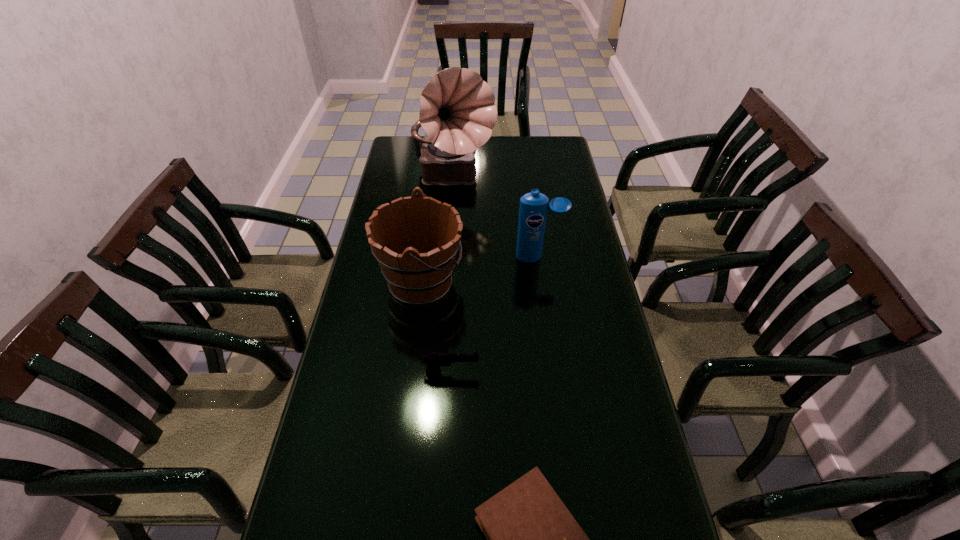
Locate an element on the screen. vacant space in between the second shortest object and the shampoo is located at coordinates (494, 314).

Select which object appears as the closest to the record player. Please provide its 2D coordinates. Your answer should be formatted as a tuple, i.e. [(x, y)], where the tuple contains the x and y coordinates of a point satisfying the conditions above.

[(421, 274)]

Find the location of a particular element. This screenshot has height=540, width=960. object that is the fourth closest one to the wine bucket is located at coordinates (532, 539).

Find the location of a particular element. vacant space that satisfies the following two spatial constraints: 1. from the horn of the farthest object; 2. with the handle on the wine bucket is located at coordinates point(446,283).

Find the location of a particular element. The width and height of the screenshot is (960, 540). vacant space that satisfies the following two spatial constraints: 1. from the horn of the farthest object; 2. with the handle on the wine bucket is located at coordinates (446, 283).

Locate an element on the screen. The width and height of the screenshot is (960, 540). vacant space that satisfies the following two spatial constraints: 1. on the front side of the shampoo; 2. with the handle on the wine bucket is located at coordinates (542, 283).

Locate an element on the screen. Image resolution: width=960 pixels, height=540 pixels. vacant region that satisfies the following two spatial constraints: 1. from the horn of the shampoo; 2. on the left side of the farthest object is located at coordinates (448, 257).

Locate an element on the screen. vacant space that satisfies the following two spatial constraints: 1. on the front side of the shampoo; 2. on the front-facing side of the fourth tallest object is located at coordinates (554, 372).